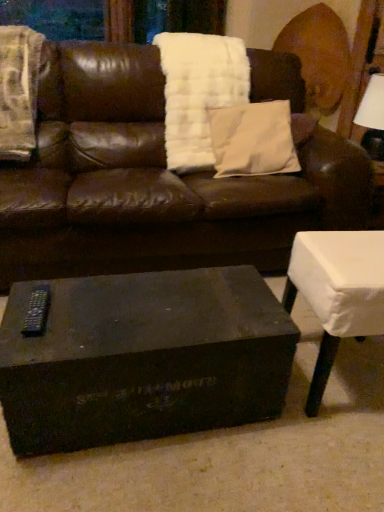
The width and height of the screenshot is (384, 512). What are the coordinates of `vacant space in front of black plastic remote at lower left` in the screenshot? It's located at (31, 345).